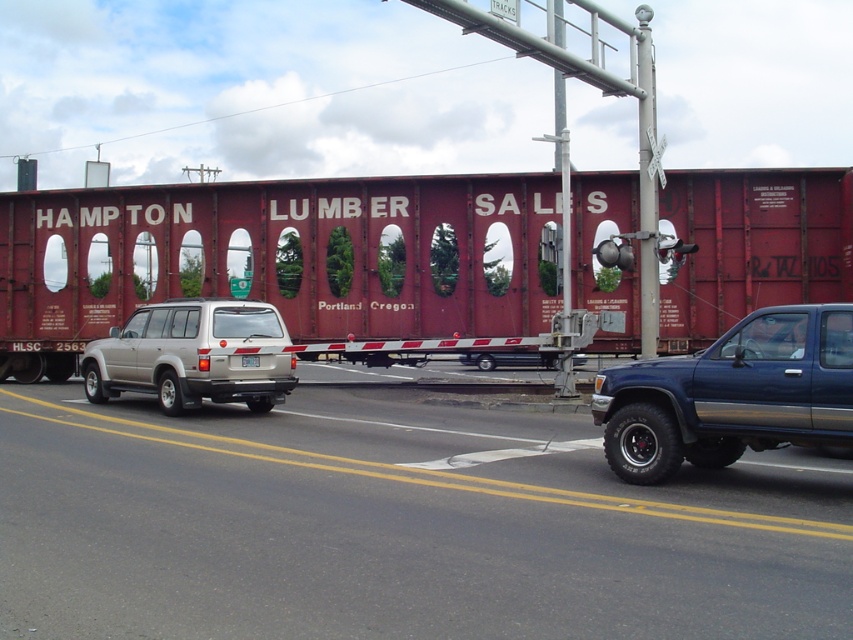
Question: Which point appears closest to the camera in this image?

Choices:
 (A) (624, 474)
 (B) (599, 493)

Answer: (B)

Question: Which object is farther from the camera taking this photo?

Choices:
 (A) satin silver suv at center
 (B) blue metallic truck at right
 (C) matte red truck at center
 (D) gray asphalt road at center

Answer: (C)

Question: Is blue metallic truck at right wider than white plastic license plate at center?

Choices:
 (A) no
 (B) yes

Answer: (B)

Question: Does gray asphalt road at center have a lesser width compared to satin silver suv at center?

Choices:
 (A) yes
 (B) no

Answer: (B)

Question: Where is gray asphalt road at center located in relation to satin silver suv at center in the image?

Choices:
 (A) below
 (B) above

Answer: (A)

Question: Which object appears closest to the camera in this image?

Choices:
 (A) white plastic license plate at center
 (B) gray asphalt road at center

Answer: (B)